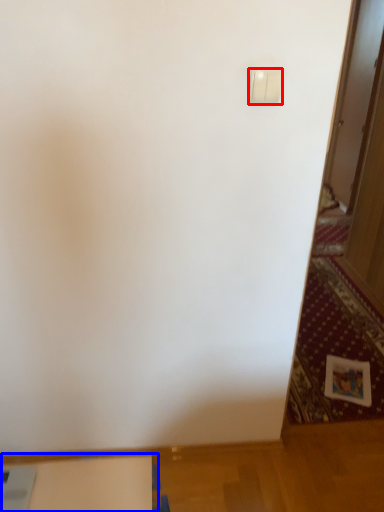
Question: Which object is closer to the camera taking this photo, light switch (highlighted by a red box) or table (highlighted by a blue box)?

Choices:
 (A) light switch
 (B) table

Answer: (A)